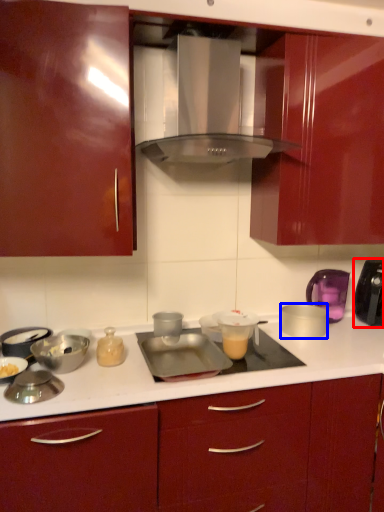
Question: Which object appears farthest to the camera in this image, kitchen appliance (highlighted by a red box) or appliance (highlighted by a blue box)?

Choices:
 (A) kitchen appliance
 (B) appliance

Answer: (A)